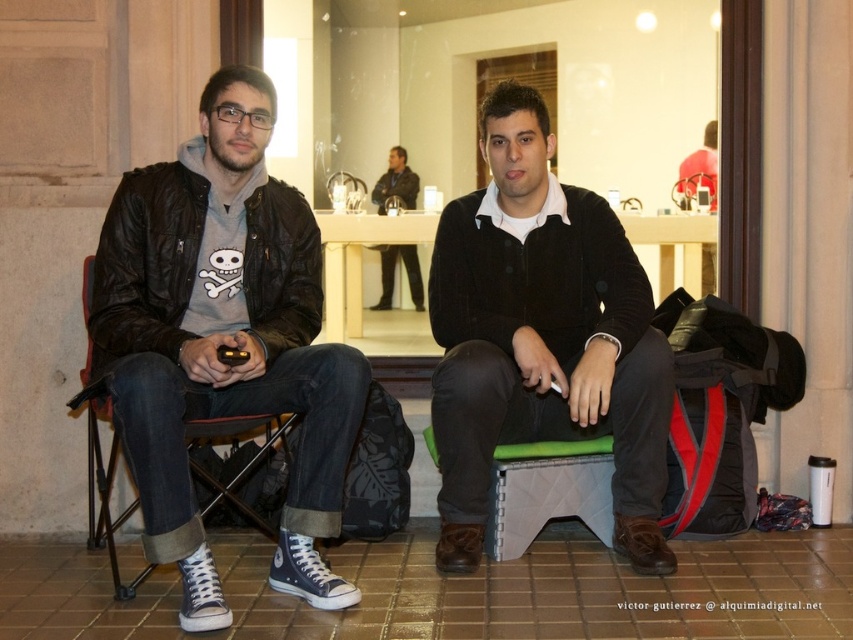
Question: Which object appears farthest from the camera in this image?

Choices:
 (A) black fabric folding chair at left
 (B) green fabric stool at lower center
 (C) dark brown sweater at center
 (D) matte black jacket at left

Answer: (B)

Question: Which is nearer to the green fabric stool at lower center?

Choices:
 (A) dark brown sweater at center
 (B) black fabric folding chair at left
 (C) matte black jacket at left

Answer: (A)

Question: Which object is the farthest from the matte black jacket at left?

Choices:
 (A) dark brown sweater at center
 (B) green fabric stool at lower center

Answer: (B)

Question: From the image, what is the correct spatial relationship of matte black jacket at left in relation to black fabric folding chair at left?

Choices:
 (A) above
 (B) below

Answer: (A)

Question: Observing the image, what is the correct spatial positioning of dark brown sweater at center in reference to black fabric folding chair at left?

Choices:
 (A) right
 (B) left

Answer: (A)

Question: Observing the image, what is the correct spatial positioning of dark brown sweater at center in reference to green fabric stool at lower center?

Choices:
 (A) below
 (B) above

Answer: (B)